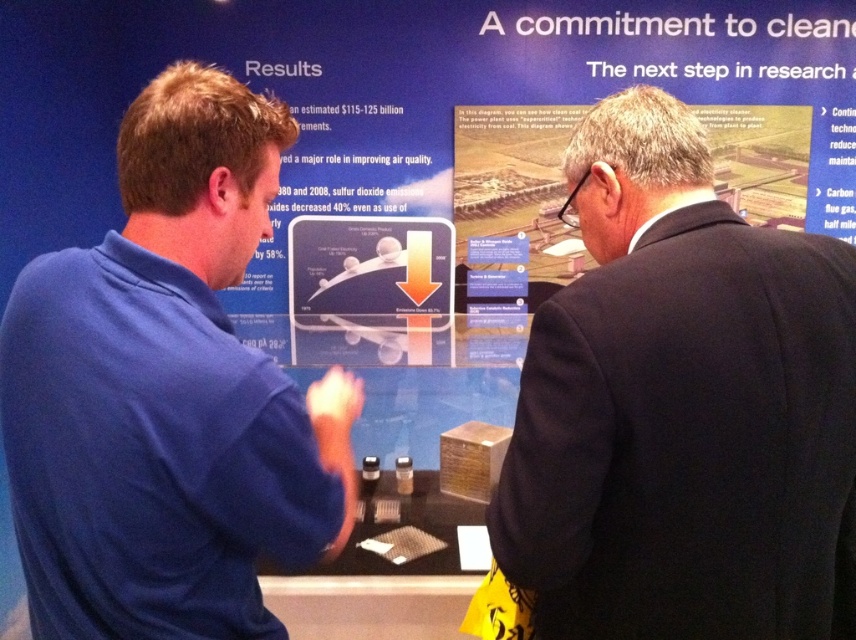
You are a photographer setting up for a group photo in front of the display. You need to ensure both the black suit at right and the blue fabric shirt at left are fully visible in the frame. Based on their positions and sizes, which person should you position closer to the center to avoid cropping either?

The black suit at right might be wider than the blue fabric shirt at left, so positioning the person in the black suit at right closer to the center would help ensure both are fully visible without cropping.

You are a tour guide at the exhibition and need to point out two specific points on the display. The first point is at coordinates point (657, 378) and the second is at point (174, 86). Which of these points is nearer to the camera?

Point (657, 378) is closer to the camera than point (174, 86).